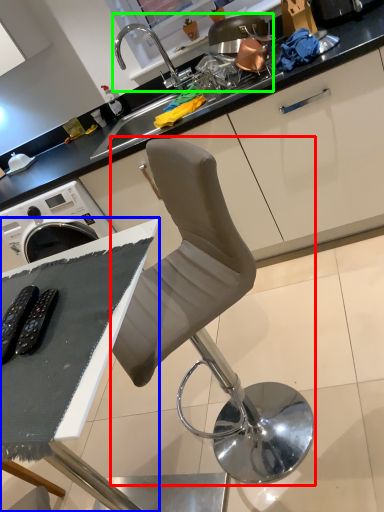
Question: Estimate the real-world distances between objects in this image. Which object is closer to chair (highlighted by a red box), table (highlighted by a blue box) or sink (highlighted by a green box)?

Choices:
 (A) table
 (B) sink

Answer: (A)